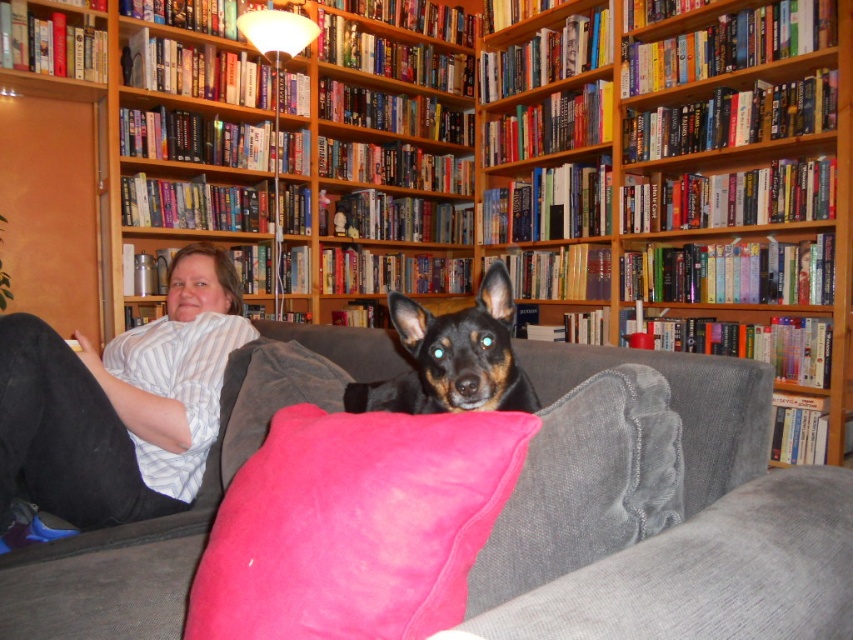
Between point (585, 509) and point (494, 328), which one is positioned behind?

The point (494, 328) is behind.

Between point (640, 580) and point (393, 401), which one is positioned behind?

Point (393, 401)

Where is `gray fabric couch at center`? gray fabric couch at center is located at coordinates (665, 513).

Does velvet pink pillow at center have a lesser height compared to pink velvety pillow at center?

Yes, velvet pink pillow at center is shorter than pink velvety pillow at center.

Where is `velvet pink pillow at center`? The width and height of the screenshot is (853, 640). velvet pink pillow at center is located at coordinates (355, 525).

This screenshot has width=853, height=640. Find the location of `velvet pink pillow at center`. velvet pink pillow at center is located at coordinates (355, 525).

Is the position of wooden bookshelf at upper center more distant than that of pink velvety pillow at center?

Yes, it is.

How much distance is there between wooden bookshelf at upper center and pink velvety pillow at center?

wooden bookshelf at upper center and pink velvety pillow at center are 7.57 feet apart from each other.

Describe the element at coordinates (640, 196) in the screenshot. I see `wooden bookshelf at upper center` at that location.

Image resolution: width=853 pixels, height=640 pixels. I want to click on wooden bookshelf at upper center, so click(x=640, y=196).